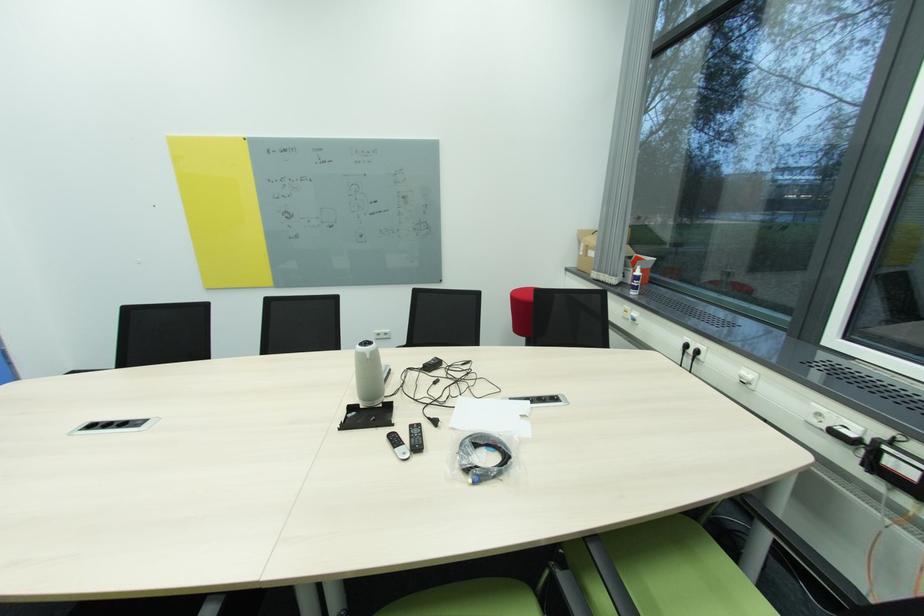
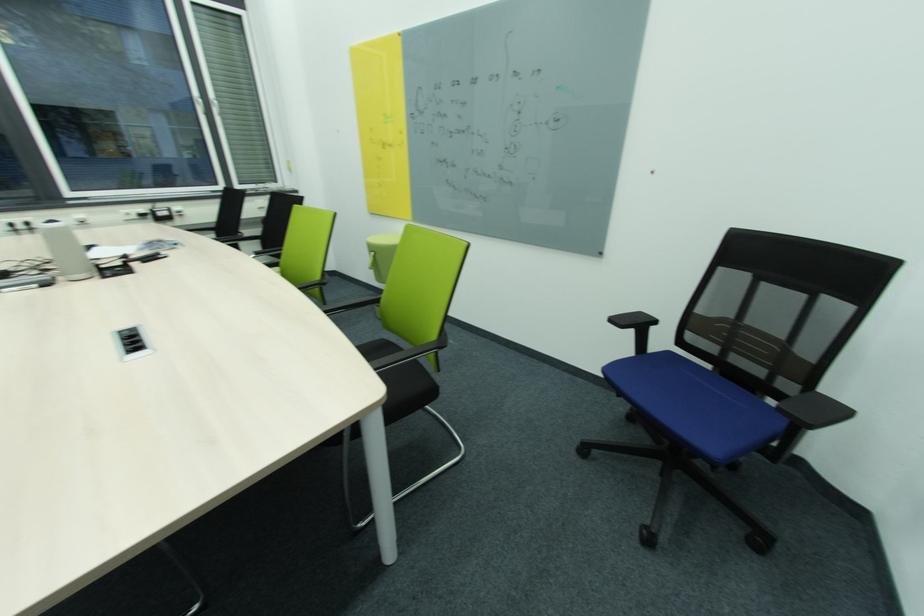
Where in the second image is the point corresponding to (141,421) from the first image?

(126, 338)